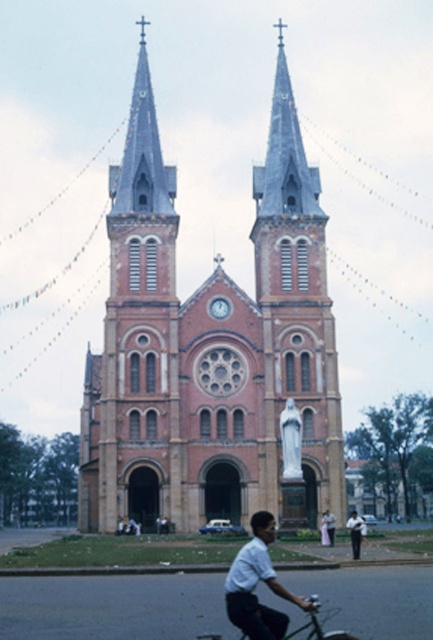
You are standing in front of the church and notice a specific point marked at coordinates point (210, 348). Based on the scene description, what object does this point most likely represent?

The point (210, 348) corresponds to the brown brick church at center.

You are standing in front of the brown brick church at center and want to see the metallic silver bicycle at lower center. Which direction should you look to see the bicycle?

The brown brick church at center is positioned over the metallic silver bicycle at lower center, so you should look downward to see the bicycle.